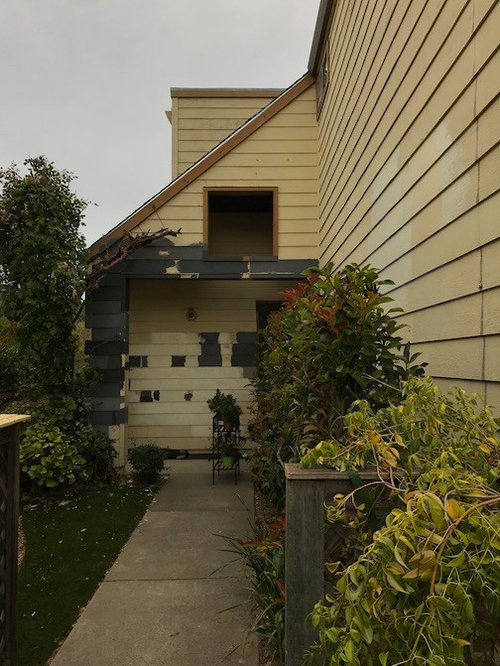
Where is `window`? window is located at coordinates (324, 70).